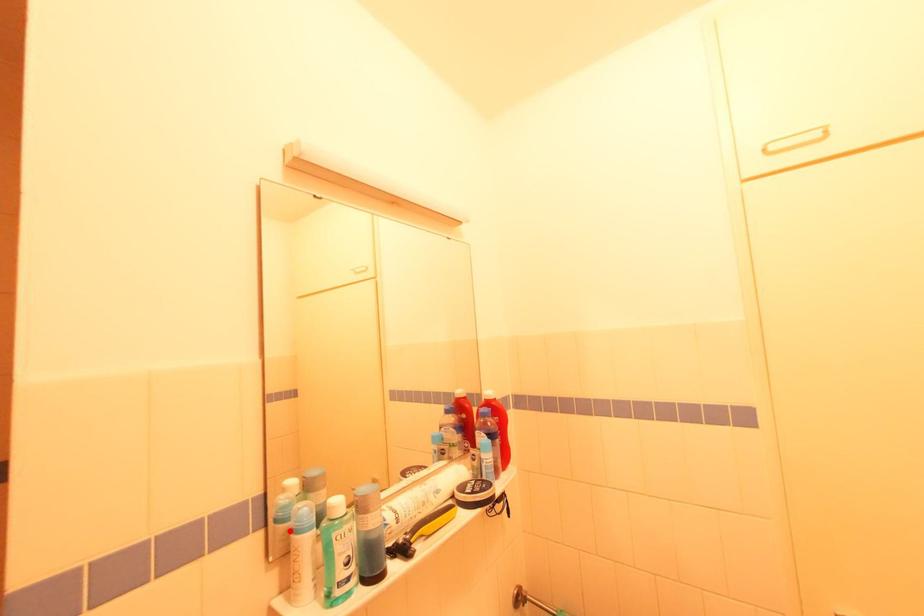
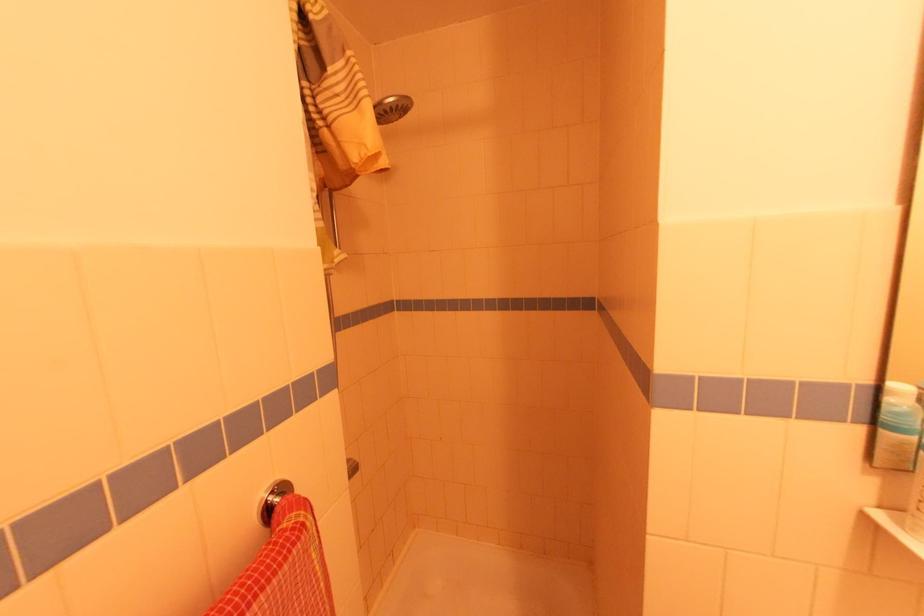
In the second image, find the point that corresponds to the highlighted location in the first image.

(906, 445)